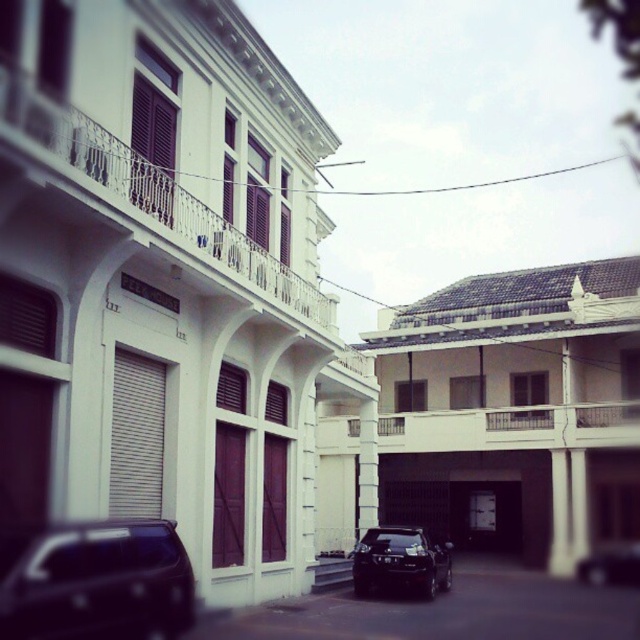
Which is behind, point (29, 582) or point (365, 538)?

The point (365, 538) is more distant.

Based on the photo, does dark matte car at lower left have a lesser width compared to shiny black suv at center?

Indeed, dark matte car at lower left has a lesser width compared to shiny black suv at center.

Identify the location of dark matte car at lower left. (97, 580).